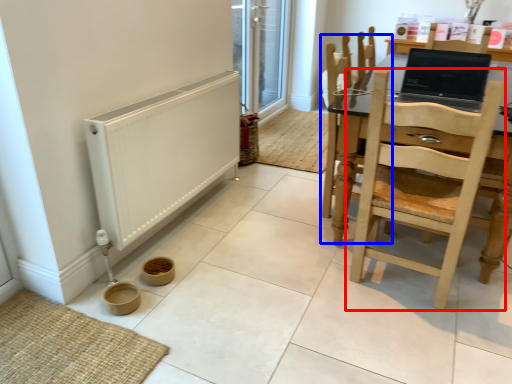
Question: Which point is further to the camera, chair (highlighted by a red box) or chair (highlighted by a blue box)?

Choices:
 (A) chair
 (B) chair

Answer: (B)